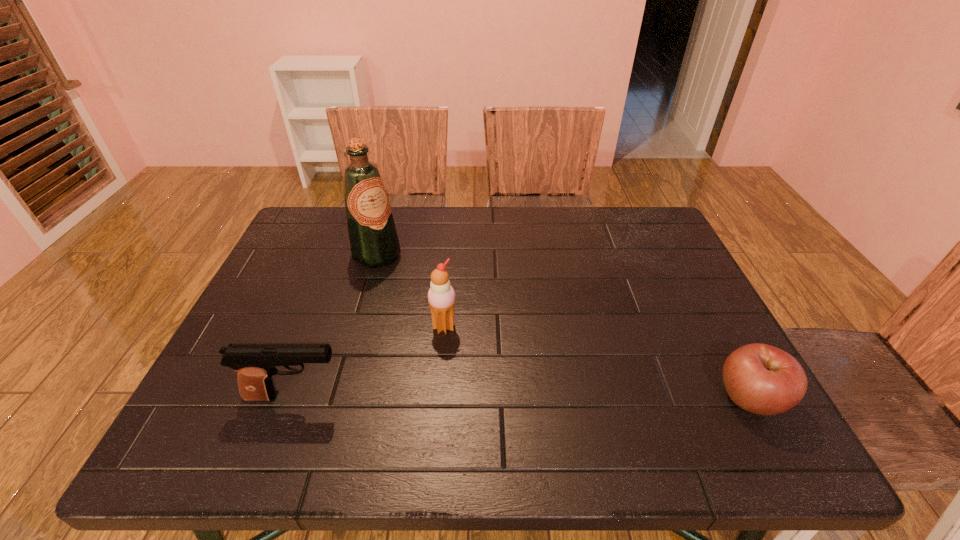
At what (x,y) coordinates should I click in order to perform the action: click on vacant region between the shortest object and the pistol. Please return your answer as a coordinate pair (x, y). Looking at the image, I should click on (522, 397).

Locate an element on the screen. This screenshot has width=960, height=540. free area in between the second object from right to left and the second shortest object is located at coordinates (370, 361).

You are a GUI agent. You are given a task and a screenshot of the screen. Output one action in this format:
    pyautogui.click(x=<x>, y=<y>)
    Task: Click on the free space that is in between the rightmost object and the farthest object
    
    Given the screenshot: What is the action you would take?
    pyautogui.click(x=564, y=326)

The width and height of the screenshot is (960, 540). Find the location of `vacant space that's between the second object from right to left and the shortest object`. vacant space that's between the second object from right to left and the shortest object is located at coordinates (596, 362).

This screenshot has width=960, height=540. I want to click on vacant area that lies between the second object from right to left and the olive oil, so click(x=410, y=291).

I want to click on free space between the farthest object and the second shortest object, so click(336, 326).

Identify the location of the closest object relative to the olive oil. Image resolution: width=960 pixels, height=540 pixels. (441, 296).

Identify which object is located as the third nearest to the olive oil. Please provide its 2D coordinates. Your answer should be formatted as a tuple, i.e. [(x, y)], where the tuple contains the x and y coordinates of a point satisfying the conditions above.

[(762, 379)]

Locate an element on the screen. Image resolution: width=960 pixels, height=540 pixels. free spot that satisfies the following two spatial constraints: 1. on the front side of the farthest object; 2. on the side of the shortest object with the unique marking is located at coordinates pos(336,397).

Where is `blank area in the image that satisfies the following two spatial constraints: 1. on the front side of the olive oil; 2. on the side of the shortest object with the unique marking`? This screenshot has height=540, width=960. blank area in the image that satisfies the following two spatial constraints: 1. on the front side of the olive oil; 2. on the side of the shortest object with the unique marking is located at coordinates (336, 397).